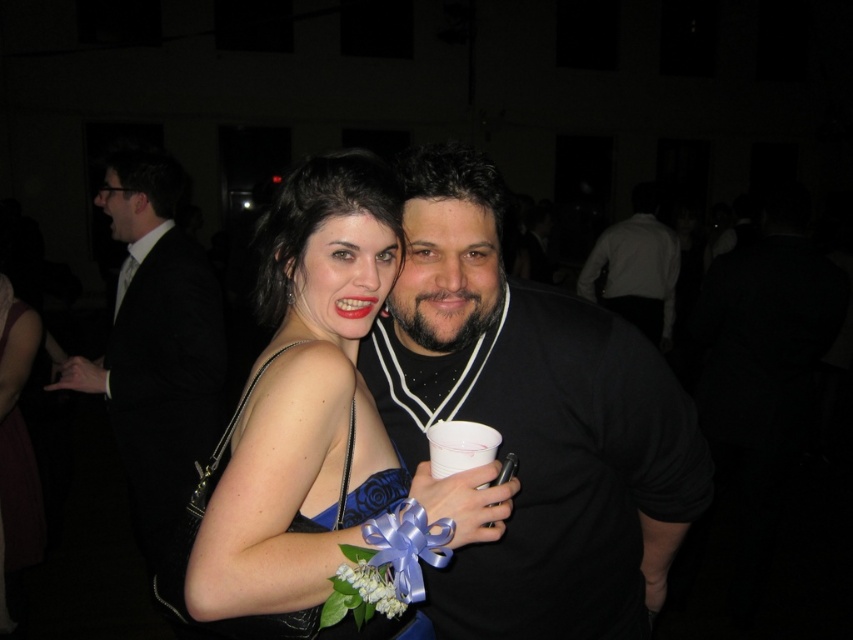
Is point (393, 506) farther from camera compared to point (209, 442)?

No, it is in front of (209, 442).

Is satin blue dress at center to the left of black satin suit at left from the viewer's perspective?

No, satin blue dress at center is not to the left of black satin suit at left.

Describe the element at coordinates (317, 413) in the screenshot. I see `satin blue dress at center` at that location.

This screenshot has width=853, height=640. Identify the location of satin blue dress at center. (317, 413).

Does black matte shirt at center have a smaller size compared to satin blue dress at center?

Actually, black matte shirt at center might be larger than satin blue dress at center.

Between black matte shirt at center and satin blue dress at center, which one is positioned higher?

satin blue dress at center is higher up.

I want to click on black matte shirt at center, so click(x=532, y=420).

Does black matte shirt at center appear on the right side of black satin suit at left?

Correct, you'll find black matte shirt at center to the right of black satin suit at left.

Based on the photo, which of these two, black matte shirt at center or black satin suit at left, stands taller?

black satin suit at left is taller.

Between point (445, 300) and point (114, 330), which one is positioned behind?

Point (114, 330)

Locate an element on the screen. black matte shirt at center is located at coordinates (532, 420).